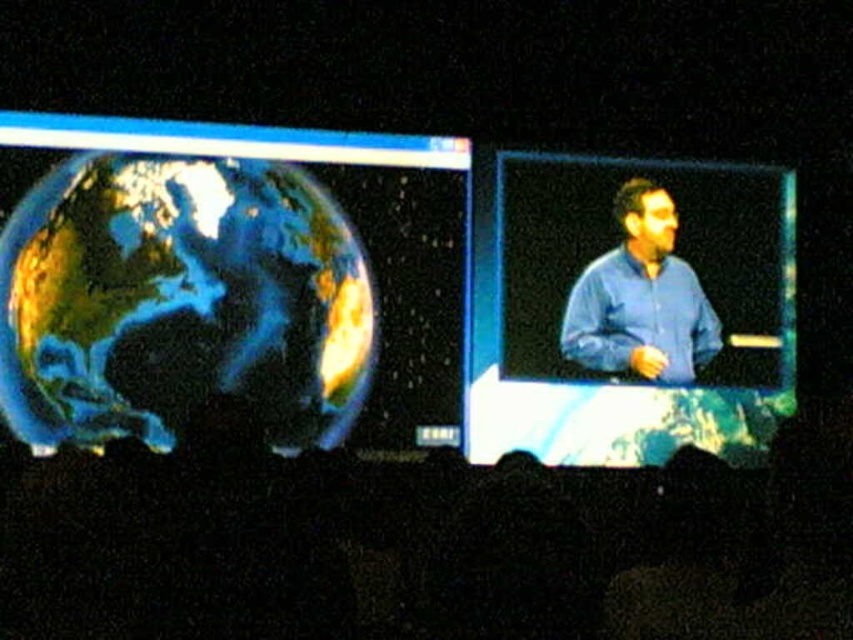
Which is more to the left, earth-like globe at left or blue shirt at center?

From the viewer's perspective, earth-like globe at left appears more on the left side.

Which is below, earth-like globe at left or blue shirt at center?

earth-like globe at left is below.

Between point (207, 321) and point (666, 243), which one is positioned in front?

Point (207, 321) is more forward.

Locate an element on the screen. This screenshot has height=640, width=853. earth-like globe at left is located at coordinates (228, 280).

Between smooth fabric screen at center and blue shirt at center, which one has more height?

blue shirt at center

Between point (390, 484) and point (646, 211), which one is positioned behind?

Point (646, 211)

Where is `smooth fabric screen at center`? smooth fabric screen at center is located at coordinates (427, 547).

Who is positioned more to the left, blue fabric screen at right or blue shirt at center?

Positioned to the left is blue shirt at center.

Is point (589, 236) positioned after point (666, 368)?

Yes, it is.

Locate an element on the screen. blue fabric screen at right is located at coordinates (628, 308).